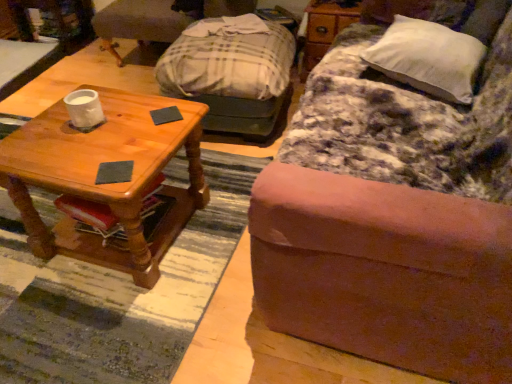
I want to click on vacant area that lies between dark gray matte coaster at center, which is the 2th pad in bottom-to-top order, and gray felt coaster at center, which is the 2th pad from top to bottom, so click(x=144, y=141).